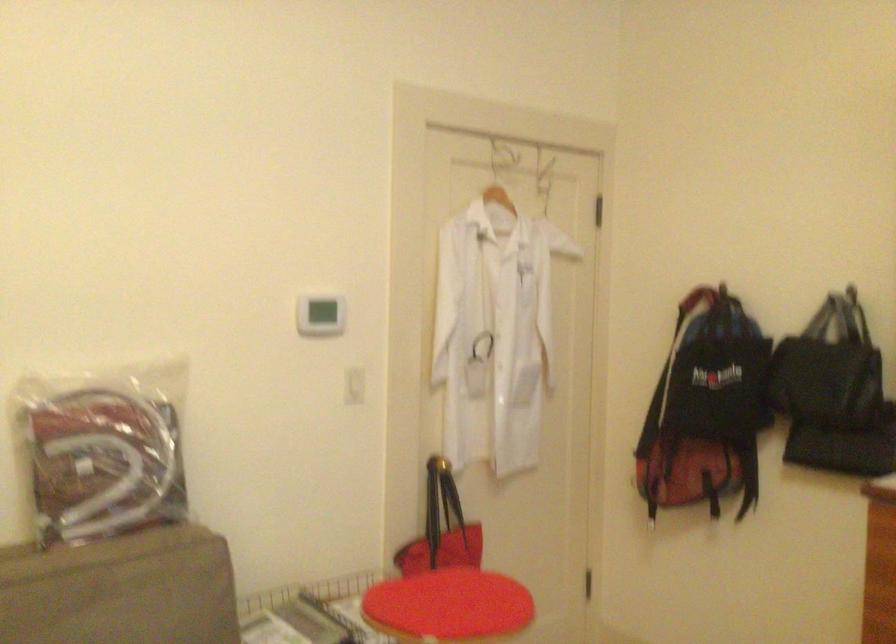
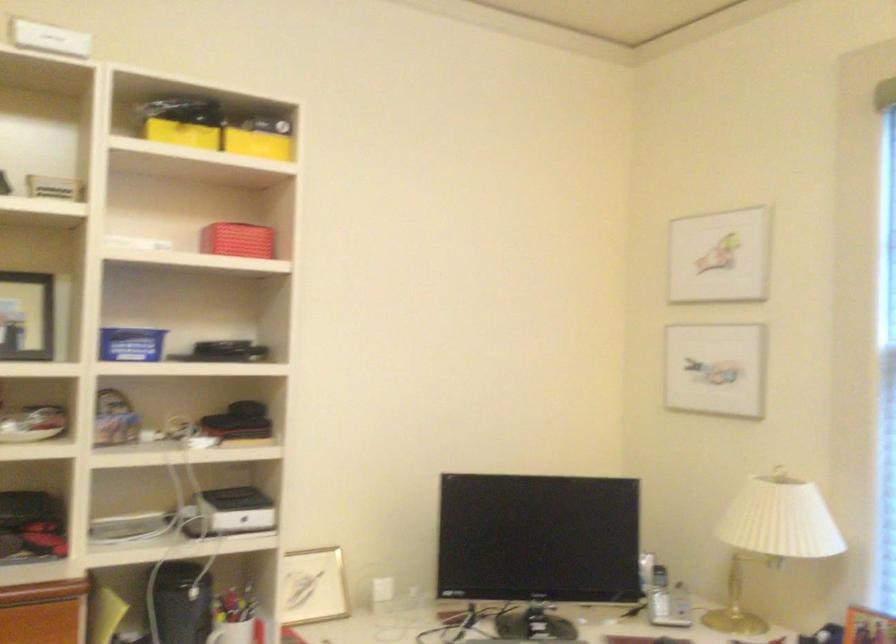
Question: The images are taken continuously from a first-person perspective. In which direction is your viewpoint rotating?

Choices:
 (A) Left
 (B) Right
 (C) Up
 (D) Down

Answer: (B)